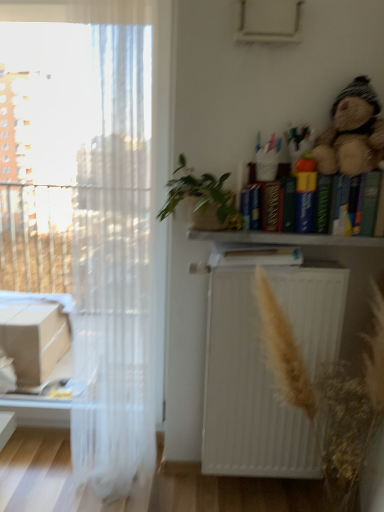
Question: Should I look upward or downward to see brown textured plant at center?

Choices:
 (A) down
 (B) up

Answer: (A)

Question: Considering the relative sizes of fuzzy brown teddy bear at upper right and hardcover book at center, the 1th book in the left-to-right sequence, in the image provided, is fuzzy brown teddy bear at upper right smaller than hardcover book at center, the 1th book in the left-to-right sequence,?

Choices:
 (A) yes
 (B) no

Answer: (B)

Question: Can you confirm if fuzzy brown teddy bear at upper right is taller than hardcover book at center, the first book when ordered from bottom to top?

Choices:
 (A) yes
 (B) no

Answer: (A)

Question: Considering the relative sizes of fuzzy brown teddy bear at upper right and hardcover book at center, the 1th book in the left-to-right sequence, in the image provided, is fuzzy brown teddy bear at upper right bigger than hardcover book at center, the 1th book in the left-to-right sequence,?

Choices:
 (A) yes
 (B) no

Answer: (A)

Question: Are fuzzy brown teddy bear at upper right and hardcover book at center, the first book when ordered from bottom to top, located far from each other?

Choices:
 (A) yes
 (B) no

Answer: (B)

Question: From the image's perspective, does fuzzy brown teddy bear at upper right appear higher than hardcover book at center, which is counted as the 2th book, starting from the right?

Choices:
 (A) yes
 (B) no

Answer: (A)

Question: From a real-world perspective, is fuzzy brown teddy bear at upper right positioned over hardcover book at center, the 2th book viewed from the top, based on gravity?

Choices:
 (A) yes
 (B) no

Answer: (A)

Question: Does hardcover book at center, the first book when ordered from bottom to top, have a lesser height compared to transparent fabric at left?

Choices:
 (A) no
 (B) yes

Answer: (B)

Question: From a real-world perspective, is hardcover book at center, which is counted as the 2th book, starting from the right, positioned over transparent fabric at left based on gravity?

Choices:
 (A) no
 (B) yes

Answer: (B)

Question: From the image's perspective, is hardcover book at center, the 2th book viewed from the top, on top of transparent fabric at left?

Choices:
 (A) yes
 (B) no

Answer: (B)

Question: Is hardcover book at center, the 1th book in the left-to-right sequence, further to camera compared to transparent fabric at left?

Choices:
 (A) no
 (B) yes

Answer: (A)

Question: Is hardcover book at center, which is counted as the 2th book, starting from the right, not inside transparent fabric at left?

Choices:
 (A) yes
 (B) no

Answer: (A)

Question: Is hardcover book at center, the 2th book viewed from the top, to the right of transparent fabric at left from the viewer's perspective?

Choices:
 (A) yes
 (B) no

Answer: (A)

Question: Is wooden bookshelf at upper right bigger than green woven basket at upper center?

Choices:
 (A) yes
 (B) no

Answer: (B)